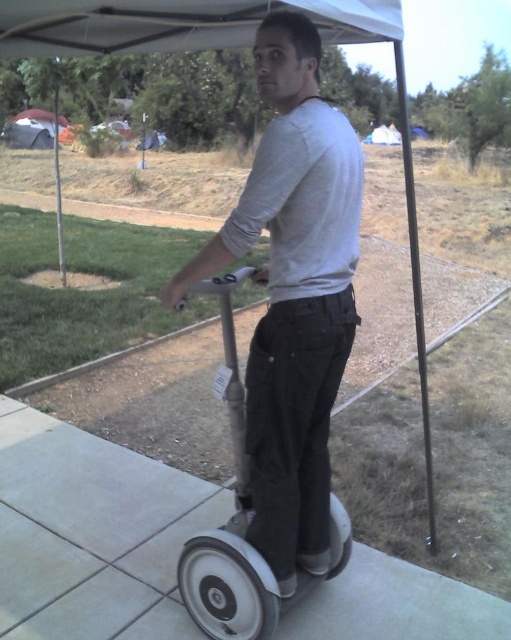
Between white fabric canopy at upper center and metallic pole at upper right, which one appears on the left side from the viewer's perspective?

white fabric canopy at upper center

The width and height of the screenshot is (511, 640). What do you see at coordinates (178, 22) in the screenshot?
I see `white fabric canopy at upper center` at bounding box center [178, 22].

Which is behind, point (188, 1) or point (428, 413)?

Point (188, 1)

Locate an element on the screen. white fabric canopy at upper center is located at coordinates (178, 22).

Is point (197, 557) positioned in front of point (400, 134)?

That is True.

Image resolution: width=511 pixels, height=640 pixels. Describe the element at coordinates (242, 524) in the screenshot. I see `silver metallic scooter at center` at that location.

Identify the location of silver metallic scooter at center. Image resolution: width=511 pixels, height=640 pixels. (242, 524).

Between point (272, 32) and point (55, 86), which one is positioned in front?

Point (272, 32)

Who is shorter, matte gray segway at center or metallic pole at left?

With less height is matte gray segway at center.

Measure the distance between point [273,227] and camera.

The distance of point [273,227] from camera is 4.90 feet.

The width and height of the screenshot is (511, 640). In order to click on matte gray segway at center in this screenshot , I will do `click(292, 294)`.